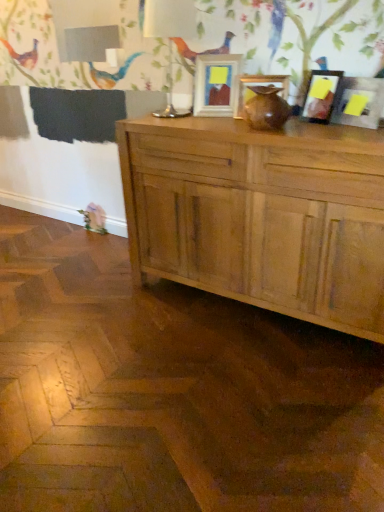
Question: Is white glossy table lamp at upper center bigger than matte wooden picture frame at center, which is the 4th picture frame in right-to-left order?

Choices:
 (A) no
 (B) yes

Answer: (B)

Question: Does white glossy table lamp at upper center have a lesser width compared to matte wooden picture frame at center, which is the 4th picture frame in right-to-left order?

Choices:
 (A) yes
 (B) no

Answer: (B)

Question: Is white glossy table lamp at upper center wider than matte wooden picture frame at center, arranged as the 1th picture frame when viewed from the left?

Choices:
 (A) no
 (B) yes

Answer: (B)

Question: Considering the relative positions of white glossy table lamp at upper center and matte wooden picture frame at center, which is the 4th picture frame in right-to-left order, in the image provided, is white glossy table lamp at upper center behind matte wooden picture frame at center, which is the 4th picture frame in right-to-left order,?

Choices:
 (A) yes
 (B) no

Answer: (B)

Question: Is matte wooden picture frame at center, arranged as the 1th picture frame when viewed from the left, at the back of white glossy table lamp at upper center?

Choices:
 (A) no
 (B) yes

Answer: (A)

Question: Does white glossy table lamp at upper center have a smaller size compared to matte wooden picture frame at center, which is the 4th picture frame in right-to-left order?

Choices:
 (A) no
 (B) yes

Answer: (A)

Question: Is matte wooden picture frame at center, acting as the 2th picture frame starting from the left, facing away from matte black picture frame at upper right, placed as the 3th picture frame when sorted from left to right?

Choices:
 (A) no
 (B) yes

Answer: (A)

Question: Can you see matte wooden picture frame at center, acting as the 2th picture frame starting from the left, touching matte black picture frame at upper right, placed as the 2th picture frame when sorted from right to left?

Choices:
 (A) yes
 (B) no

Answer: (B)

Question: Does matte wooden picture frame at center, which appears as the 3th picture frame when viewed from the right, have a larger size compared to matte black picture frame at upper right, placed as the 2th picture frame when sorted from right to left?

Choices:
 (A) no
 (B) yes

Answer: (B)

Question: From a real-world perspective, is matte wooden picture frame at center, acting as the 2th picture frame starting from the left, under matte black picture frame at upper right, placed as the 2th picture frame when sorted from right to left?

Choices:
 (A) no
 (B) yes

Answer: (B)

Question: Does matte wooden picture frame at center, acting as the 2th picture frame starting from the left, lie in front of matte black picture frame at upper right, placed as the 2th picture frame when sorted from right to left?

Choices:
 (A) yes
 (B) no

Answer: (B)

Question: Is matte wooden picture frame at center, acting as the 2th picture frame starting from the left, far away from matte black picture frame at upper right, placed as the 3th picture frame when sorted from left to right?

Choices:
 (A) no
 (B) yes

Answer: (A)

Question: Is matte wooden picture frame at center, which is the 4th picture frame in right-to-left order, thinner than matte wooden picture frame at center, which appears as the 3th picture frame when viewed from the right?

Choices:
 (A) no
 (B) yes

Answer: (A)